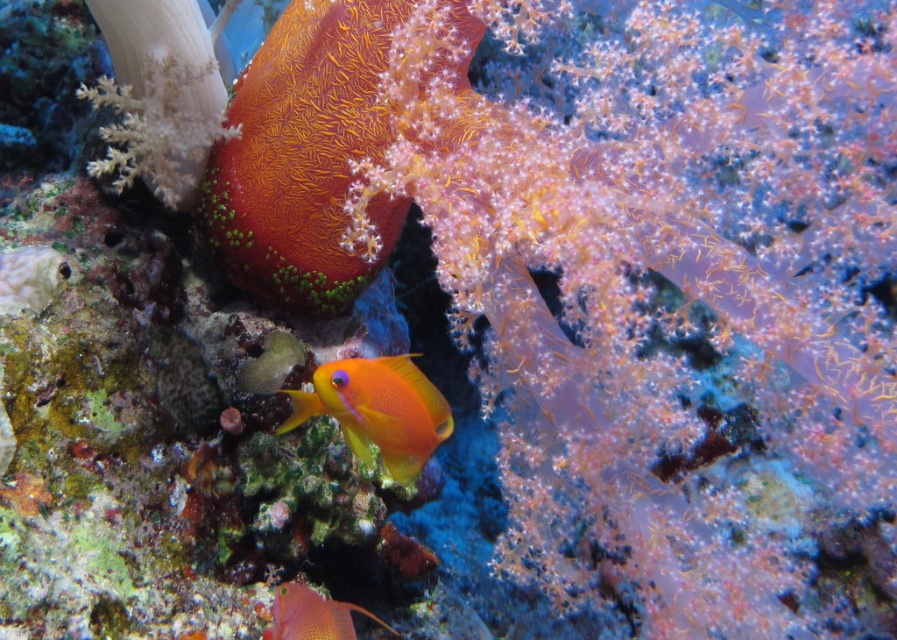
You are a marine biologist observing an underwater scene with an orange matte fish at center and an orange glossy fish at center. Which fish is smaller in size?

The orange matte fish at center is smaller in size compared to the orange glossy fish at center.